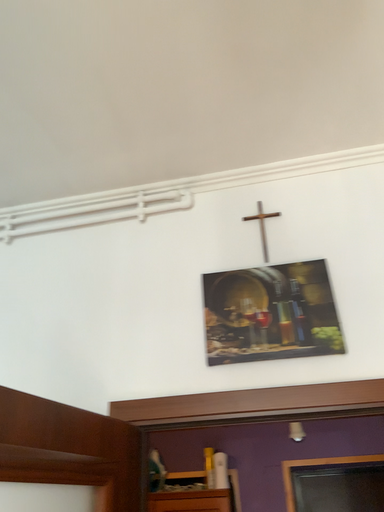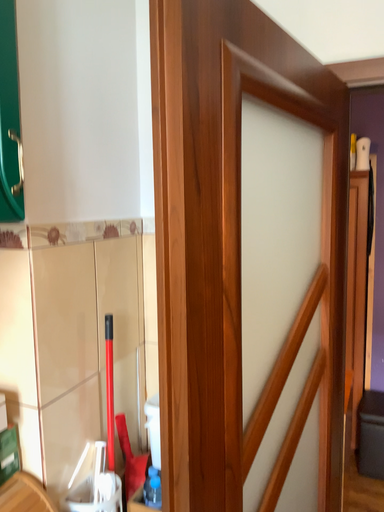
Question: Which way did the camera rotate in the video?

Choices:
 (A) rotated downward
 (B) rotated upward

Answer: (A)